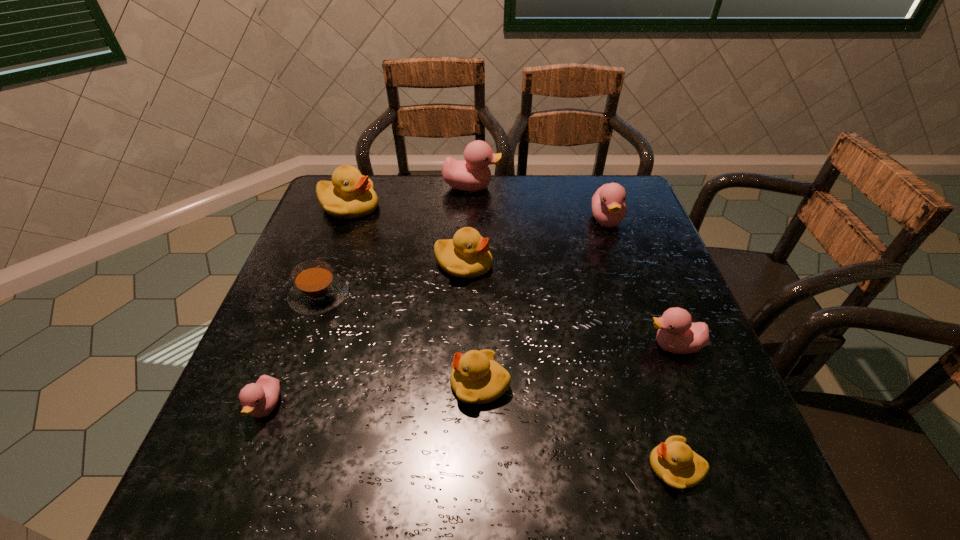
This screenshot has width=960, height=540. I want to click on the nearest pink duckling, so click(259, 399).

Where is `cappuccino`? The image size is (960, 540). cappuccino is located at coordinates (316, 290).

Locate an element on the screen. Image resolution: width=960 pixels, height=540 pixels. the smallest yellow duckling is located at coordinates click(674, 462).

The image size is (960, 540). Find the location of `the nearest yellow duckling`. the nearest yellow duckling is located at coordinates (674, 462).

Locate an element on the screen. vacant space located on the front-facing side of the biggest pink duckling is located at coordinates (552, 187).

Identify the location of free spot located 0.250m at the face of the farthest yellow duckling. Image resolution: width=960 pixels, height=540 pixels. (465, 207).

This screenshot has width=960, height=540. Identify the location of free region located 0.340m on the front-facing side of the third nearest pink duckling. (646, 338).

Locate an element on the screen. vacant position located 0.080m at the face of the third nearest yellow duckling is located at coordinates (524, 264).

Image resolution: width=960 pixels, height=540 pixels. Find the location of `free space located on the front-facing side of the second smallest pink duckling`. free space located on the front-facing side of the second smallest pink duckling is located at coordinates (478, 346).

Identify the location of free space located on the front-facing side of the second smallest pink duckling. (550, 346).